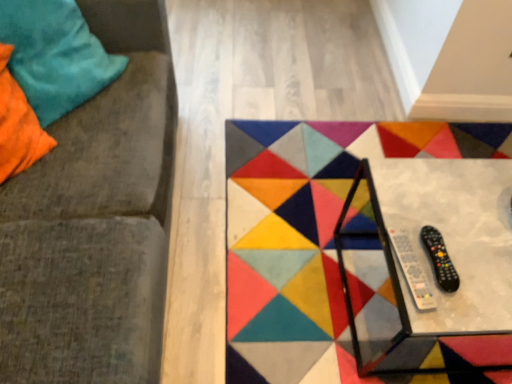
The height and width of the screenshot is (384, 512). Identify the location of unoccupied region to the right of black plastic remote at lower right. (475, 264).